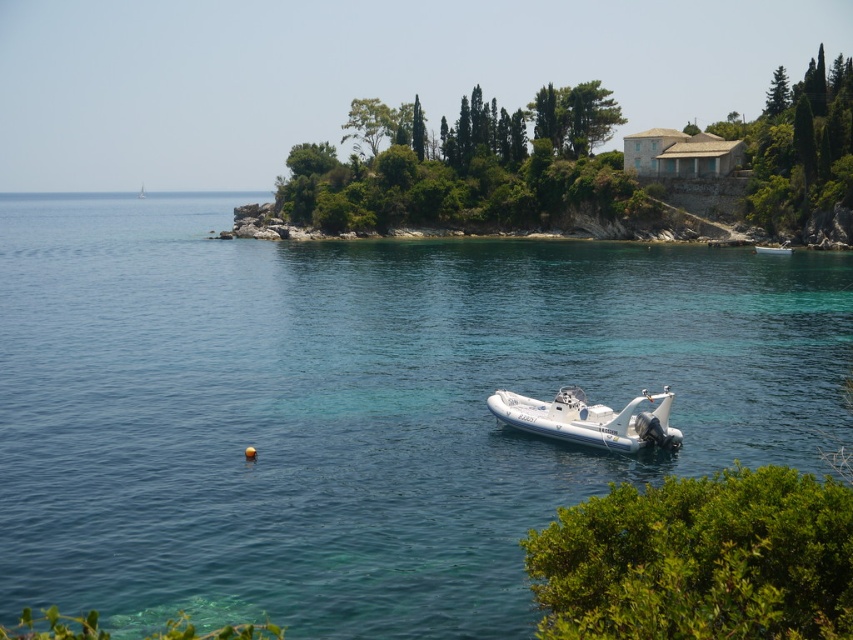
Based on the photo, which of these two, clear blue water at center or white rubber boat at center, stands shorter?

Standing shorter between the two is white rubber boat at center.

Who is taller, clear blue water at center or white rubber boat at center?

Standing taller between the two is clear blue water at center.

Identify the location of clear blue water at center. The image size is (853, 640). pos(358,406).